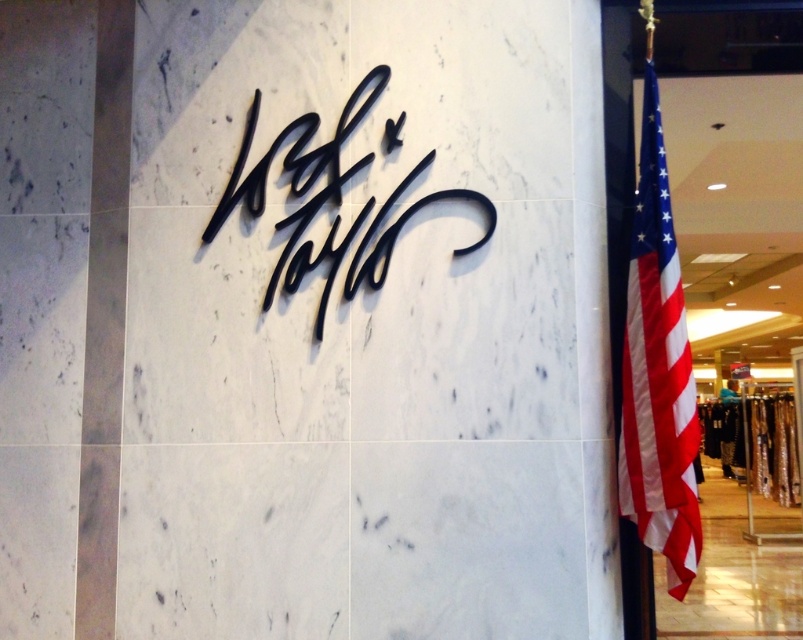
This screenshot has width=803, height=640. What do you see at coordinates (657, 371) in the screenshot? I see `american flag at right` at bounding box center [657, 371].

Who is more distant from viewer, (638, 396) or (461, 256)?

The point (638, 396) is more distant.

This screenshot has height=640, width=803. In order to click on american flag at right in this screenshot , I will do `click(657, 371)`.